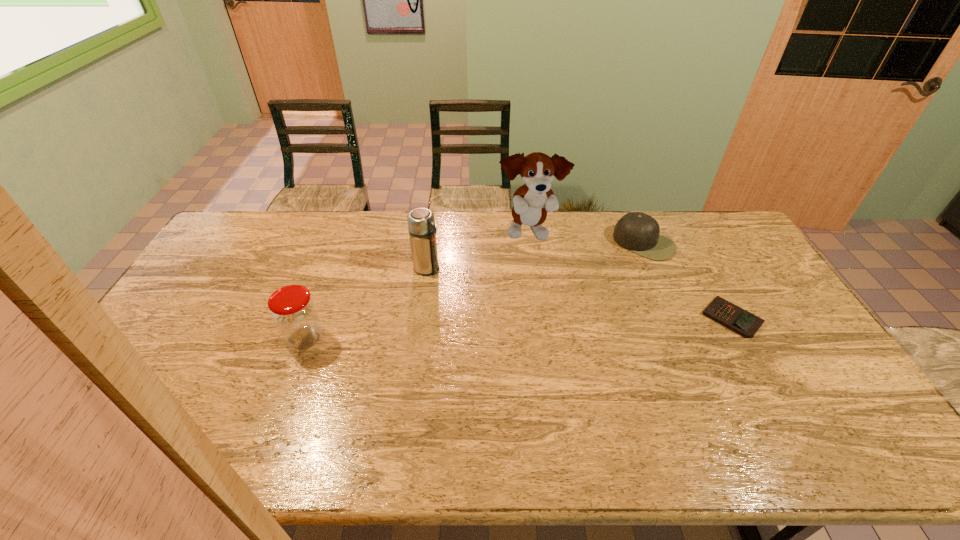
You are a GUI agent. You are given a task and a screenshot of the screen. Output one action in this format:
    pyautogui.click(x=<x>, y=<y>)
    Task: Click on the free location that satisfies the following two spatial constraints: 1. on the back side of the thermos bottle; 2. on the right side of the tallest object
    Image resolution: width=960 pixels, height=540 pixels.
    Given the screenshot: What is the action you would take?
    pyautogui.click(x=432, y=233)

At what (x,y) coordinates should I click in order to perform the action: click on free space that satisfies the following two spatial constraints: 1. on the back side of the calculator; 2. on the right side of the third shortest object. Please return your answer as a coordinate pair (x, y). Looking at the image, I should click on (313, 318).